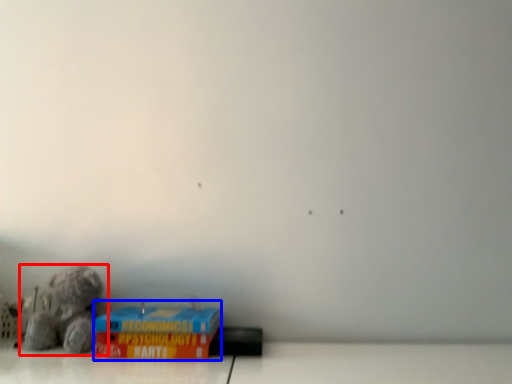
Question: Which object appears closest to the camera in this image, toy (highlighted by a red box) or cardboard box (highlighted by a blue box)?

Choices:
 (A) toy
 (B) cardboard box

Answer: (B)